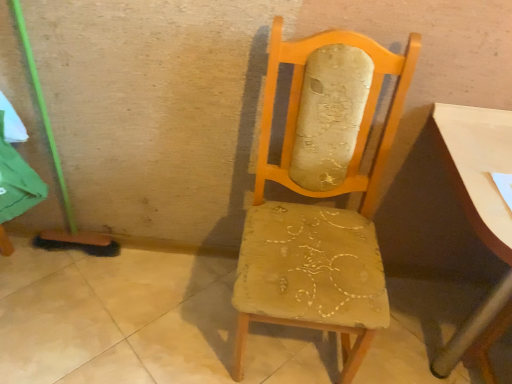
Question: Does wooden upholstered chair at center appear on the left side of smooth white table at right?

Choices:
 (A) no
 (B) yes

Answer: (B)

Question: Can you confirm if wooden upholstered chair at center is bigger than smooth white table at right?

Choices:
 (A) no
 (B) yes

Answer: (A)

Question: Does wooden upholstered chair at center have a greater height compared to smooth white table at right?

Choices:
 (A) yes
 (B) no

Answer: (A)

Question: Can you confirm if wooden upholstered chair at center is shorter than smooth white table at right?

Choices:
 (A) yes
 (B) no

Answer: (B)

Question: From the image's perspective, does wooden upholstered chair at center appear higher than smooth white table at right?

Choices:
 (A) yes
 (B) no

Answer: (A)

Question: Is wooden upholstered chair at center surrounding smooth white table at right?

Choices:
 (A) yes
 (B) no

Answer: (B)

Question: Does smooth white table at right have a larger size compared to wooden upholstered chair at center?

Choices:
 (A) no
 (B) yes

Answer: (B)

Question: Can you confirm if smooth white table at right is smaller than wooden upholstered chair at center?

Choices:
 (A) no
 (B) yes

Answer: (A)

Question: Is smooth white table at right not inside wooden upholstered chair at center?

Choices:
 (A) yes
 (B) no

Answer: (A)

Question: Does smooth white table at right touch wooden upholstered chair at center?

Choices:
 (A) yes
 (B) no

Answer: (B)

Question: Does smooth white table at right lie behind wooden upholstered chair at center?

Choices:
 (A) yes
 (B) no

Answer: (A)

Question: From a real-world perspective, is smooth white table at right located beneath wooden upholstered chair at center?

Choices:
 (A) no
 (B) yes

Answer: (B)

Question: Considering the positions of wooden upholstered chair at center and smooth white table at right in the image, is wooden upholstered chair at center wider or thinner than smooth white table at right?

Choices:
 (A) wide
 (B) thin

Answer: (B)